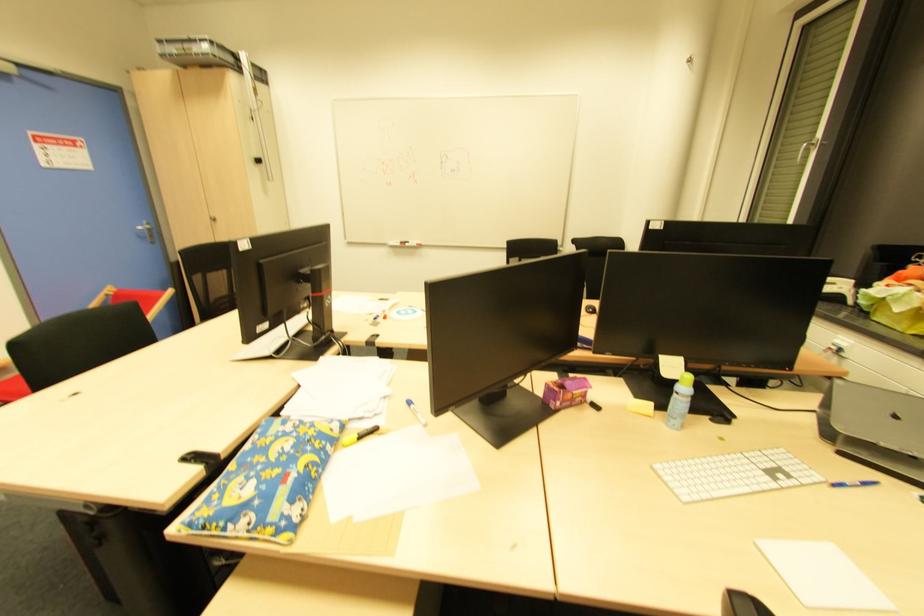
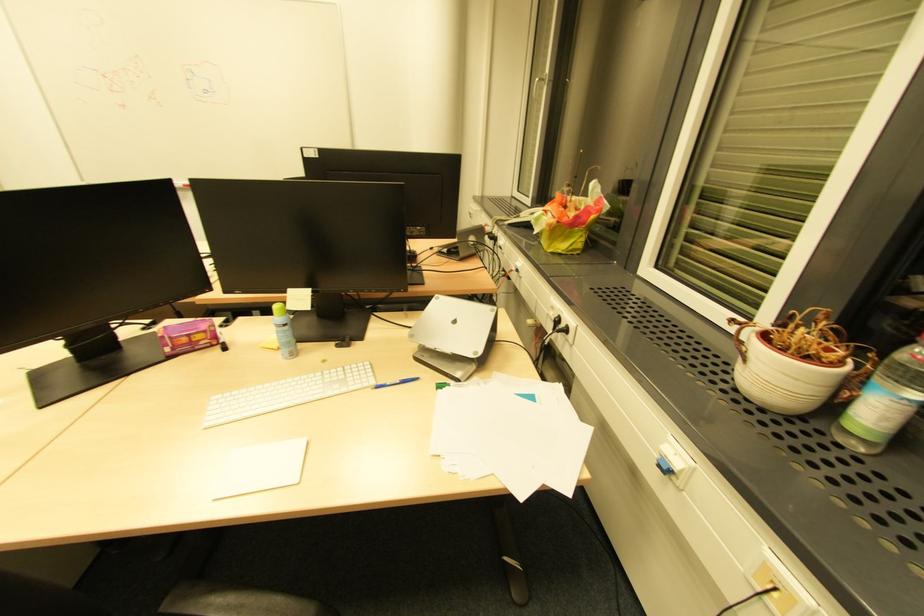
Find the pixel in the second image that matches the point at 580,400 in the first image.

(209, 342)